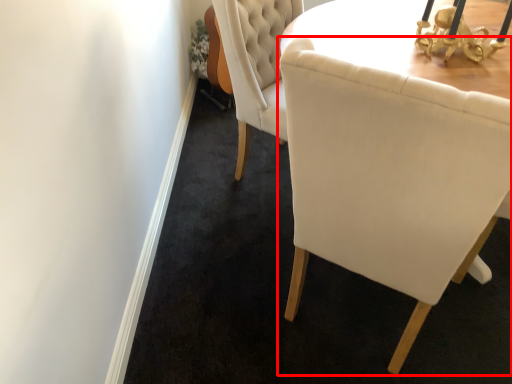
Question: From the image's perspective, what is the correct spatial relationship of chair (annotated by the red box) in relation to table lamp?

Choices:
 (A) below
 (B) above

Answer: (A)